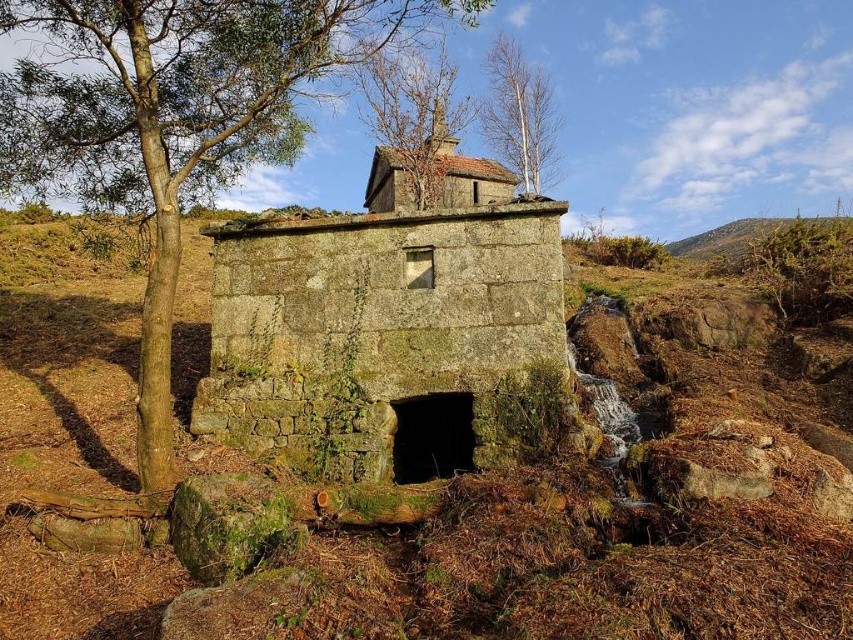
Question: Estimate the real-world distances between objects in this image. Which object is closer to the green mossy stone structure at center?

Choices:
 (A) bare wood tree at upper center
 (B) brown leafy tree at upper center

Answer: (B)

Question: Which of the following is the closest to the observer?

Choices:
 (A) green mossy hillside at upper right
 (B) green mossy stone structure at center

Answer: (B)

Question: Is green leafy tree at center-left positioned behind bare wood tree at upper center?

Choices:
 (A) no
 (B) yes

Answer: (A)

Question: Is green mossy stone bunker at center to the left of bare wood tree at upper center from the viewer's perspective?

Choices:
 (A) yes
 (B) no

Answer: (A)

Question: Which object is farther from the camera taking this photo?

Choices:
 (A) green mossy stone structure at center
 (B) brown leafy tree at upper center
 (C) green mossy stone bunker at center
 (D) bare wood tree at upper center

Answer: (D)

Question: Does brown leafy tree at upper center appear on the left side of green mossy hillside at upper right?

Choices:
 (A) no
 (B) yes

Answer: (B)